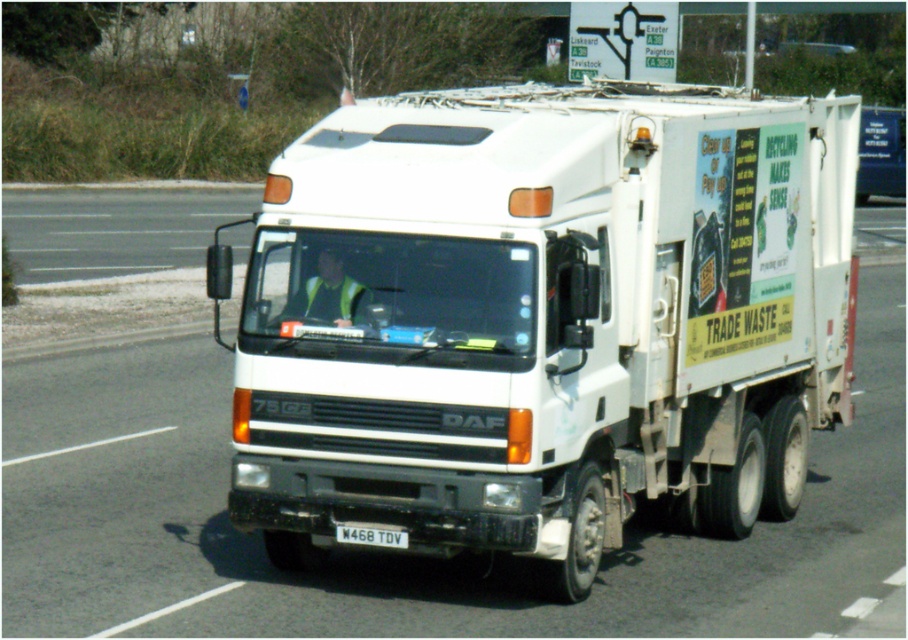
Looking at this image, you are a photographer trying to capture the white matte truck at center and the white plastic license plate at center in a single shot. Based on their sizes in the image, which object would appear smaller in the photo?

The white matte truck at center has a lesser width compared to the white plastic license plate at center, so it would appear smaller in the photo.

From the picture: You are standing on the sidewalk and see the white DAF 75GS refuse collection vehicle with its two points marked. Which of the two points, point (377,438) or point (361,538), is closer to you?

Point (377,438) is closer to the viewer than point (361,538).